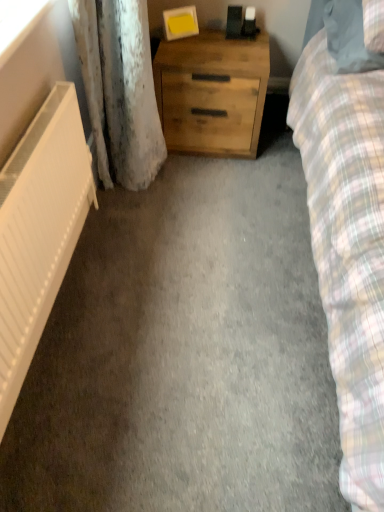
Question: Can natural wood chest of drawers at center be found inside white matte radiator at left?

Choices:
 (A) yes
 (B) no

Answer: (B)

Question: Would you say white matte radiator at left is a long distance from natural wood chest of drawers at center?

Choices:
 (A) yes
 (B) no

Answer: (B)

Question: From the image's perspective, does white matte radiator at left appear lower than natural wood chest of drawers at center?

Choices:
 (A) no
 (B) yes

Answer: (B)

Question: Is white matte radiator at left positioned before natural wood chest of drawers at center?

Choices:
 (A) yes
 (B) no

Answer: (A)

Question: Is the surface of white matte radiator at left in direct contact with natural wood chest of drawers at center?

Choices:
 (A) no
 (B) yes

Answer: (A)

Question: From their relative heights in the image, would you say plaid fabric pillow at upper right is taller or shorter than natural wood chest of drawers at center?

Choices:
 (A) short
 (B) tall

Answer: (A)

Question: From a real-world perspective, is plaid fabric pillow at upper right physically located above or below natural wood chest of drawers at center?

Choices:
 (A) below
 (B) above

Answer: (B)

Question: In terms of width, does plaid fabric pillow at upper right look wider or thinner when compared to natural wood chest of drawers at center?

Choices:
 (A) thin
 (B) wide

Answer: (B)

Question: Based on their positions, is plaid fabric pillow at upper right located to the left or right of natural wood chest of drawers at center?

Choices:
 (A) right
 (B) left

Answer: (A)

Question: From a real-world perspective, relative to white matte radiator at left, is transparent plastic window screen at upper left vertically above or below?

Choices:
 (A) above
 (B) below

Answer: (A)

Question: Is transparent plastic window screen at upper left wider or thinner than white matte radiator at left?

Choices:
 (A) thin
 (B) wide

Answer: (B)

Question: Is transparent plastic window screen at upper left to the left or to the right of white matte radiator at left in the image?

Choices:
 (A) left
 (B) right

Answer: (A)

Question: Relative to white matte radiator at left, is transparent plastic window screen at upper left in front or behind?

Choices:
 (A) behind
 (B) front

Answer: (A)

Question: Looking at the image, does white matte radiator at left seem bigger or smaller compared to natural wood chest of drawers at center?

Choices:
 (A) big
 (B) small

Answer: (B)

Question: From the image's perspective, is white matte radiator at left located above or below natural wood chest of drawers at center?

Choices:
 (A) above
 (B) below

Answer: (B)